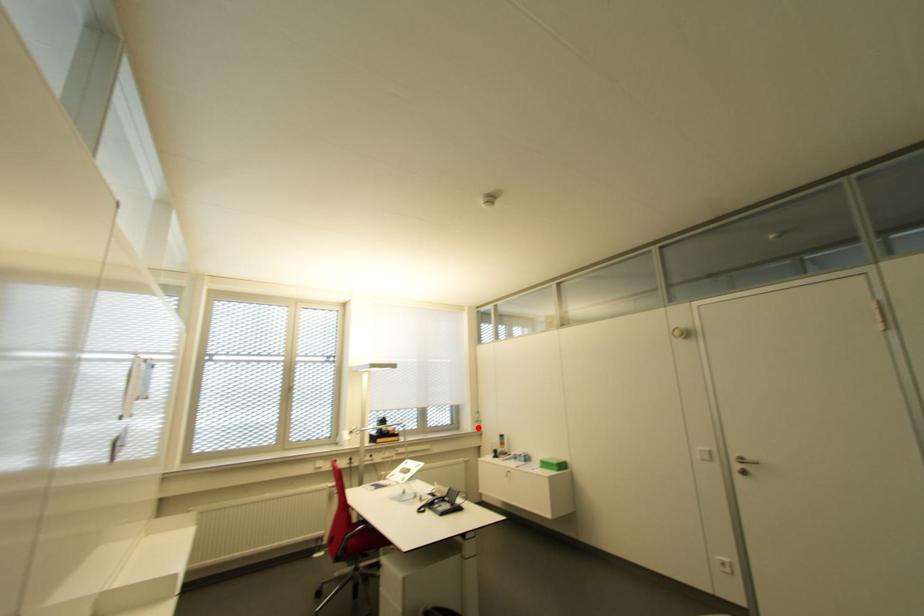
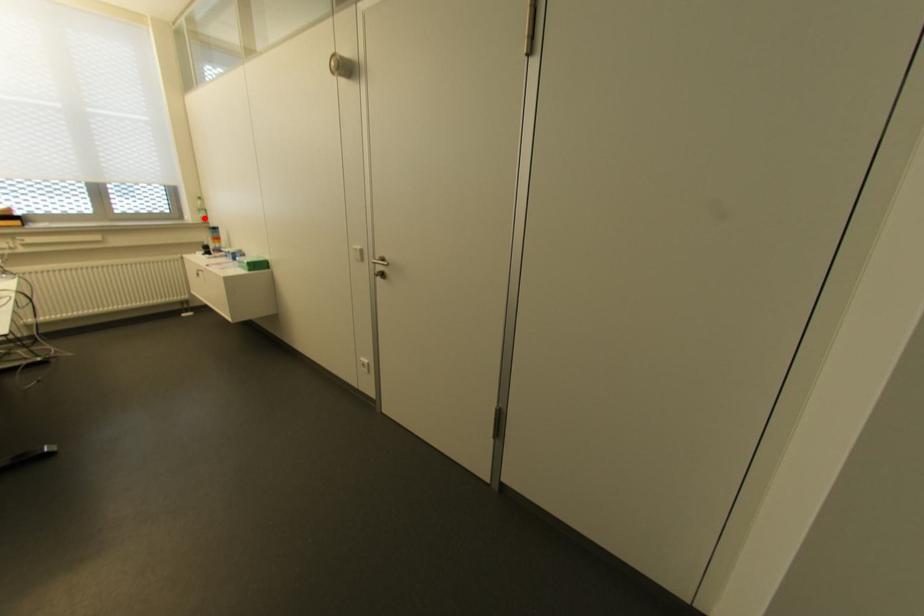
I am providing you with two images of the same scene from different viewpoints. A red point is marked on the first image and another point is marked on the second image. Is the red point in image1 aligned with the point shown in image2?

Yes